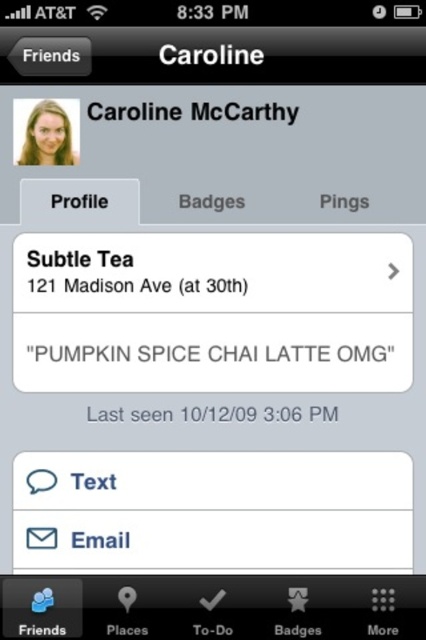
Question: Based on their relative distances, which object is nearer to the black matte text at upper center?

Choices:
 (A) matte plastic cup at center
 (B) matte blonde hair at upper left

Answer: (B)

Question: Which point is farther to the camera?

Choices:
 (A) matte plastic cup at center
 (B) matte blonde hair at upper left
 (C) black matte text at upper center

Answer: (A)

Question: Can you confirm if matte blonde hair at upper left is positioned to the left of black matte text at upper center?

Choices:
 (A) yes
 (B) no

Answer: (A)

Question: Does matte plastic cup at center have a lesser width compared to matte blonde hair at upper left?

Choices:
 (A) yes
 (B) no

Answer: (B)

Question: Which point appears closest to the camera in this image?

Choices:
 (A) (101, 288)
 (B) (282, 116)

Answer: (B)

Question: Does matte plastic cup at center have a greater width compared to black matte text at upper center?

Choices:
 (A) yes
 (B) no

Answer: (A)